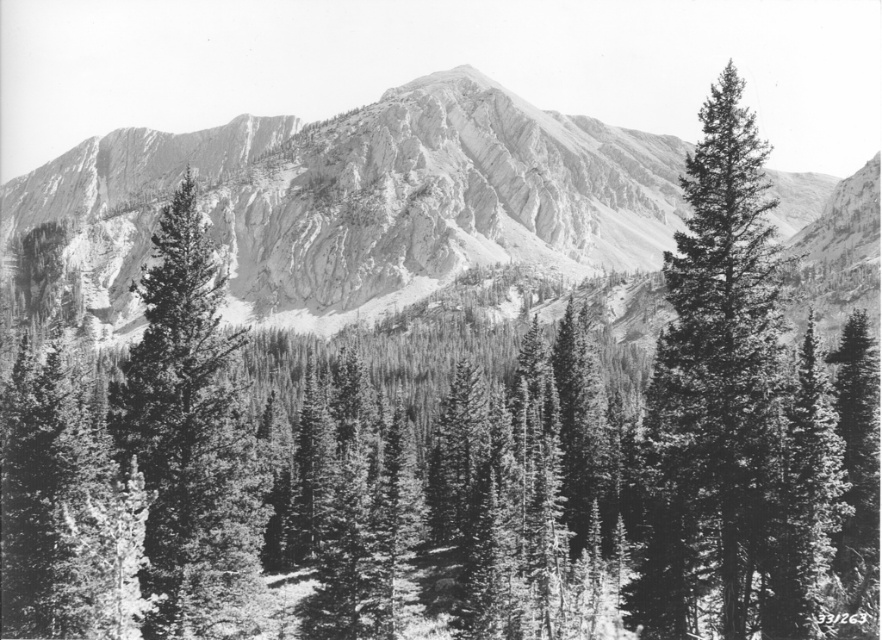
In the scene shown: In the mountainous landscape, there are two trees visible in the photograph. The smooth bark evergreen at center and the smooth green pine tree at right. Which tree is positioned higher in the image?

The smooth bark evergreen at center is located above the smooth green pine tree at right, so it is positioned higher in the image.

You are a hiker trying to identify two trees in the forest. You see a smooth bark evergreen at center and a smooth green pine tree at right. Which of these two trees is bigger?

The smooth bark evergreen at center is larger in size compared to the smooth green pine tree at right.